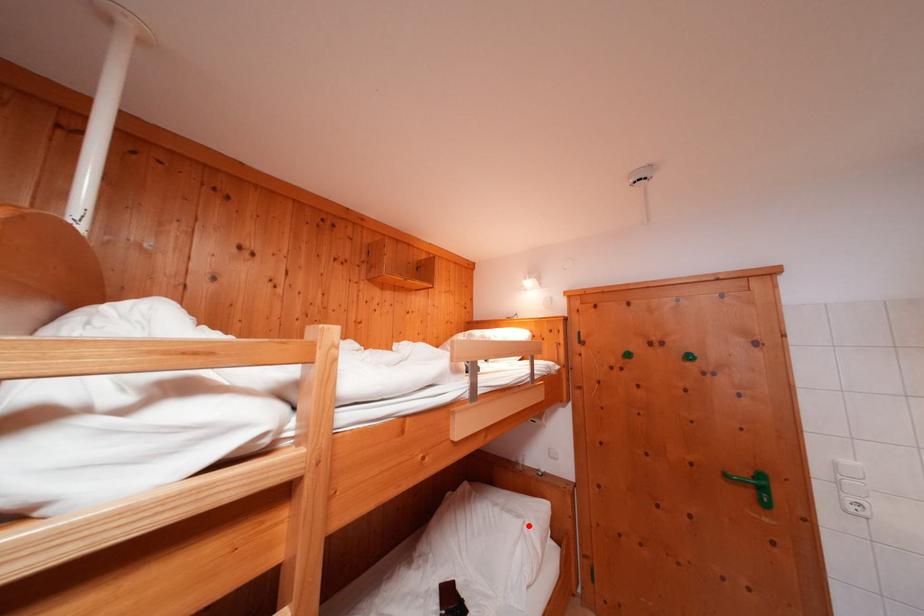
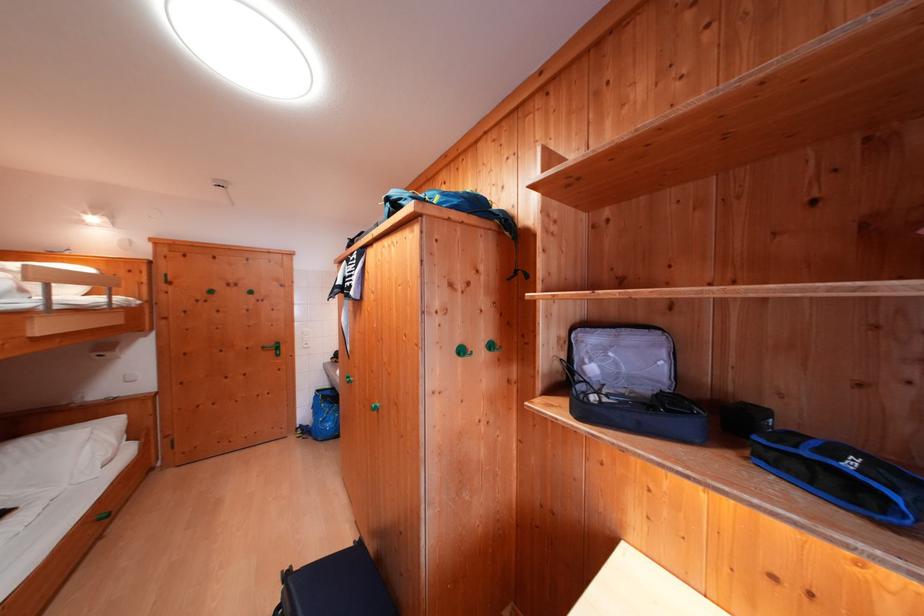
Find the pixel in the second image that matches the highlighted location in the first image.

(96, 434)